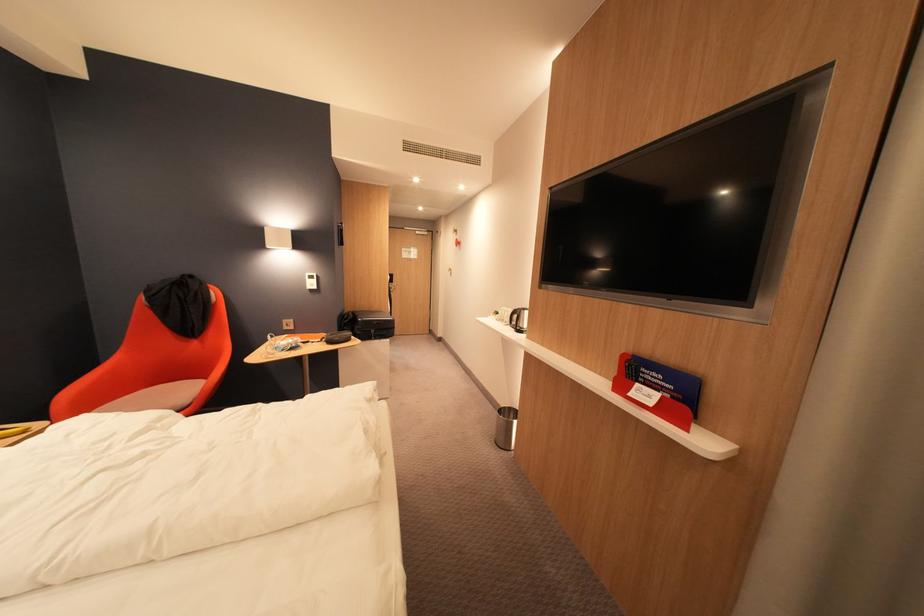
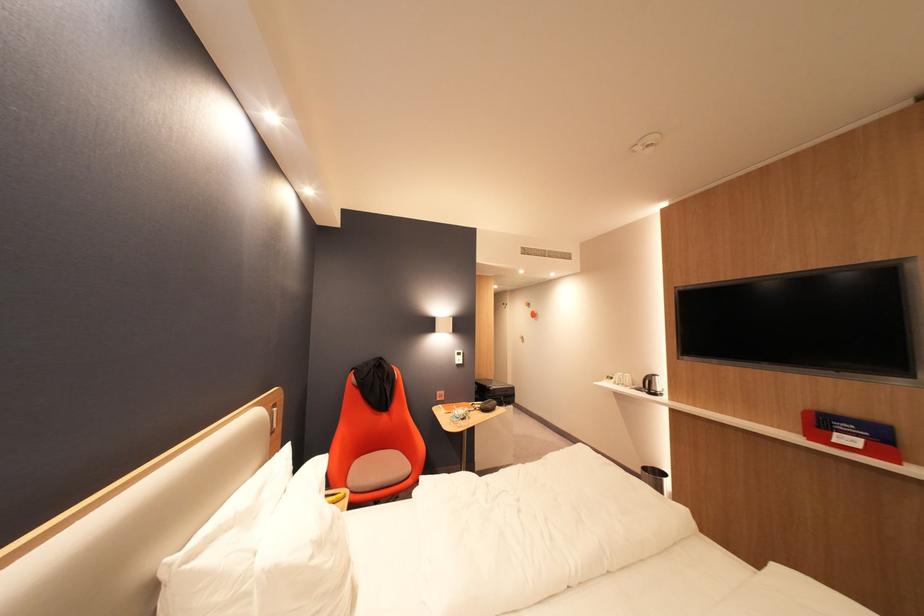
Which direction would the cameraman need to move to produce the second image?

The cameraman walked toward left, backward.